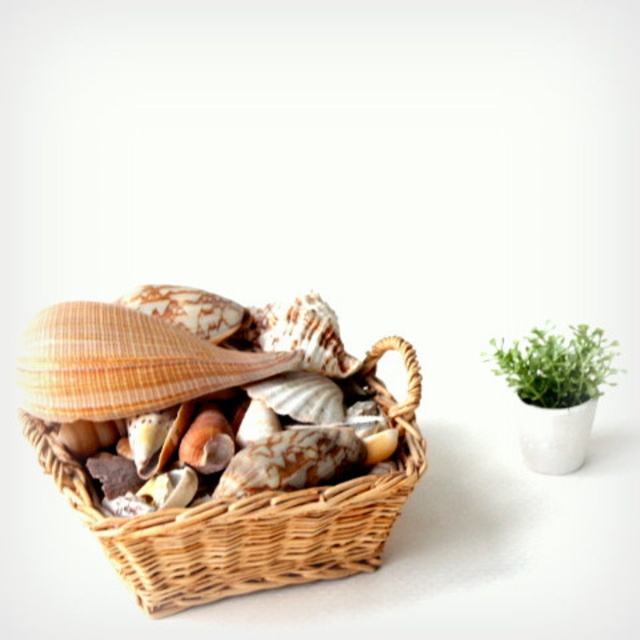
You are organizing a display and need to place the woven wood basket at left and the green leafy plant in pot at right on a shelf. The shelf has limited space, and you want to ensure both items fit without overlapping. Based on the scene description, which item should you place first to maximize space efficiency?

The woven wood basket at left is bigger than the green leafy plant in pot at right. To maximize space efficiency, place the larger item, the woven wood basket at left, first, then position the smaller green leafy plant in pot at right next to it.

You are arranging items on a shelf and want to place the woven wood basket at left and the green leafy plant in pot at right next to each other. Considering their heights, which item should be placed first to ensure stability?

The woven wood basket at left is much taller than the green leafy plant in pot at right, so to ensure stability, place the taller woven wood basket at left first and then the shorter plant next to it.

From the picture: You are a delivery robot with a 6 inch wide arm. You need to place a package between the woven wood basket at left and the orange striped seashell at center. Can your arm fit through the space between them?

The woven wood basket at left is 5.92 inches away from the orange striped seashell at center. Since your arm is 6 inches wide, it cannot fit through the space between them as the distance is slightly less than the arm width.